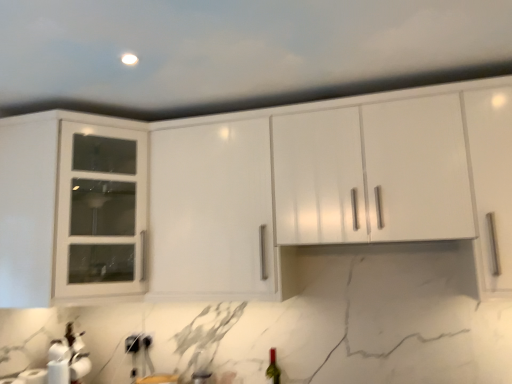
Find the location of a particular element. Image resolution: width=512 pixels, height=384 pixels. white matte paper towel at lower left is located at coordinates (34, 376).

Considering the sizes of objects white matte paper towel at lower left and white glass cabinet at upper left in the image provided, who is taller, white matte paper towel at lower left or white glass cabinet at upper left?

With more height is white glass cabinet at upper left.

Would you say white matte paper towel at lower left is inside or outside white glass cabinet at upper left?

white matte paper towel at lower left is located beyond the bounds of white glass cabinet at upper left.

Is white matte paper towel at lower left oriented away from white glass cabinet at upper left?

No.

Which of these two, white matte paper towel at lower left or white glass cabinet at upper left, is thinner?

white matte paper towel at lower left.

Is white matte paper towel at lower left wider or thinner than green glass wine bottle at lower center?

In the image, white matte paper towel at lower left appears to be wider than green glass wine bottle at lower center.

Can you confirm if white matte paper towel at lower left is positioned to the right of green glass wine bottle at lower center?

In fact, white matte paper towel at lower left is to the left of green glass wine bottle at lower center.

Is green glass wine bottle at lower center surrounded by white matte paper towel at lower left?

No, green glass wine bottle at lower center is not surrounded by white matte paper towel at lower left.

From a real-world perspective, who is located higher, white matte paper towel at lower left or green glass wine bottle at lower center?

From a 3D spatial view, green glass wine bottle at lower center is above.

In the scene shown: From the image's perspective, is green glass wine bottle at lower center located above or below white glass cabinet at upper left?

Clearly, from the image's perspective, green glass wine bottle at lower center is below white glass cabinet at upper left.

Is green glass wine bottle at lower center touching white glass cabinet at upper left?

No.

Considering their positions, is green glass wine bottle at lower center located in front of or behind white glass cabinet at upper left?

green glass wine bottle at lower center is positioned farther from the viewer than white glass cabinet at upper left.

From a real-world perspective, is white glass cabinet at upper left on green glass wine bottle at lower center?

Yes, from a real-world perspective, white glass cabinet at upper left is above green glass wine bottle at lower center.

How distant is white glass cabinet at upper left from green glass wine bottle at lower center?

white glass cabinet at upper left and green glass wine bottle at lower center are 3.99 feet apart.

Is white glass cabinet at upper left facing away from green glass wine bottle at lower center?

No, white glass cabinet at upper left is not facing away from green glass wine bottle at lower center.

Is white glass cabinet at upper left in front of or behind green glass wine bottle at lower center in the image?

white glass cabinet at upper left is positioned closer to the viewer than green glass wine bottle at lower center.

Is green glass wine bottle at lower center thinner than white matte paper towel at lower left?

Correct, the width of green glass wine bottle at lower center is less than that of white matte paper towel at lower left.

Is green glass wine bottle at lower center further to the viewer compared to white matte paper towel at lower left?

Yes.

Considering the sizes of green glass wine bottle at lower center and white matte paper towel at lower left in the image, is green glass wine bottle at lower center bigger or smaller than white matte paper towel at lower left?

Considering their sizes, green glass wine bottle at lower center takes up less space than white matte paper towel at lower left.

Which object is positioned more to the left, green glass wine bottle at lower center or white matte paper towel at lower left?

white matte paper towel at lower left is more to the left.

In terms of width, does white glass cabinet at upper left look wider or thinner when compared to white matte paper towel at lower left?

Considering their sizes, white glass cabinet at upper left looks broader than white matte paper towel at lower left.

From the image's perspective, is white glass cabinet at upper left located above or below white matte paper towel at lower left?

white glass cabinet at upper left is situated higher than white matte paper towel at lower left in the image.

Considering the sizes of objects white glass cabinet at upper left and white matte paper towel at lower left in the image provided, who is taller, white glass cabinet at upper left or white matte paper towel at lower left?

white glass cabinet at upper left is taller.

Are white glass cabinet at upper left and white matte paper towel at lower left far apart?

white glass cabinet at upper left is near white matte paper towel at lower left, not far away.

This screenshot has width=512, height=384. I want to click on paper towel below the white glass cabinet at upper left (from the image's perspective), so click(x=34, y=376).

The image size is (512, 384). What are the coordinates of `wine bottle lying on the right of white matte paper towel at lower left` in the screenshot? It's located at (273, 368).

Which object lies further to the anchor point green glass wine bottle at lower center, white matte paper towel at lower left or white glass cabinet at upper left?

The object further to green glass wine bottle at lower center is white glass cabinet at upper left.

When comparing their distances from white glass cabinet at upper left, does green glass wine bottle at lower center or white matte paper towel at lower left seem further?

The object further to white glass cabinet at upper left is green glass wine bottle at lower center.

From the image, which object appears to be nearer to white matte paper towel at lower left, white glass cabinet at upper left or green glass wine bottle at lower center?

The object closer to white matte paper towel at lower left is white glass cabinet at upper left.

Estimate the real-world distances between objects in this image. Which object is further from white glass cabinet at upper left, white matte paper towel at lower left or green glass wine bottle at lower center?

green glass wine bottle at lower center.

Which object lies nearer to the anchor point green glass wine bottle at lower center, white glass cabinet at upper left or white matte paper towel at lower left?

white matte paper towel at lower left is positioned closer to the anchor green glass wine bottle at lower center.

From the image, which object appears to be nearer to white matte paper towel at lower left, green glass wine bottle at lower center or white glass cabinet at upper left?

white glass cabinet at upper left lies closer to white matte paper towel at lower left than the other object.

Identify the location of cabinetry situated between white matte paper towel at lower left and green glass wine bottle at lower center from left to right. (71, 210).